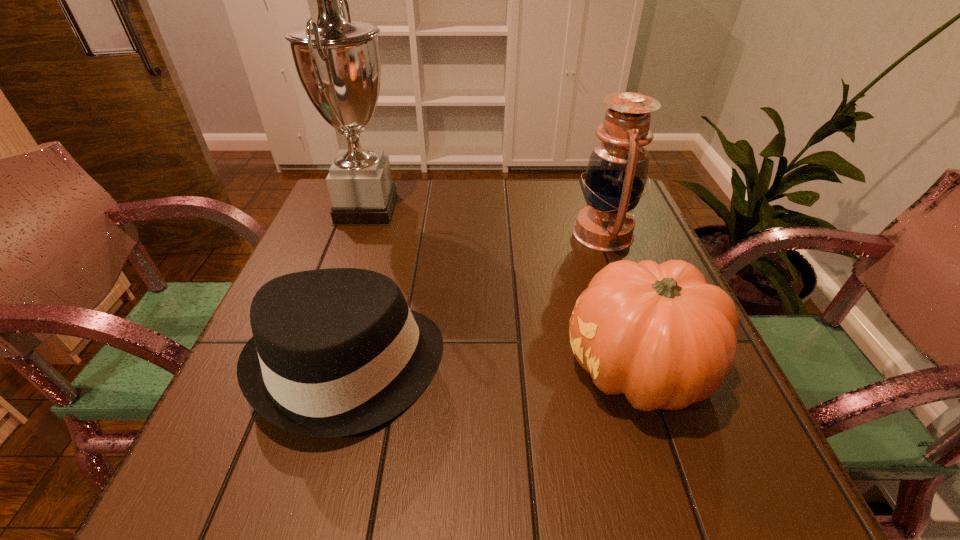
This screenshot has width=960, height=540. I want to click on the tallest object, so click(x=338, y=62).

Image resolution: width=960 pixels, height=540 pixels. I want to click on the third shortest object, so click(617, 171).

Locate an element on the screen. The image size is (960, 540). pumpkin is located at coordinates (x=658, y=333).

I want to click on the shortest object, so click(x=335, y=352).

I want to click on vacant space located at the front view of the trophy cup, so click(463, 210).

In order to click on free point located 0.240m on the left of the oil lamp in this screenshot , I will do `click(476, 234)`.

Where is `blank space located on the carved face of the pumpkin`? blank space located on the carved face of the pumpkin is located at coordinates (536, 369).

Where is `blank space located 0.300m on the carved face of the pumpkin`? Image resolution: width=960 pixels, height=540 pixels. blank space located 0.300m on the carved face of the pumpkin is located at coordinates [x=396, y=369].

At what (x,y) coordinates should I click in order to perform the action: click on free location located 0.320m on the carved face of the pumpkin. Please return your answer as a coordinate pair (x, y). The image size is (960, 540). Looking at the image, I should click on (384, 369).

Find the location of a particular element. The width and height of the screenshot is (960, 540). free region located on the right of the shortest object is located at coordinates (492, 367).